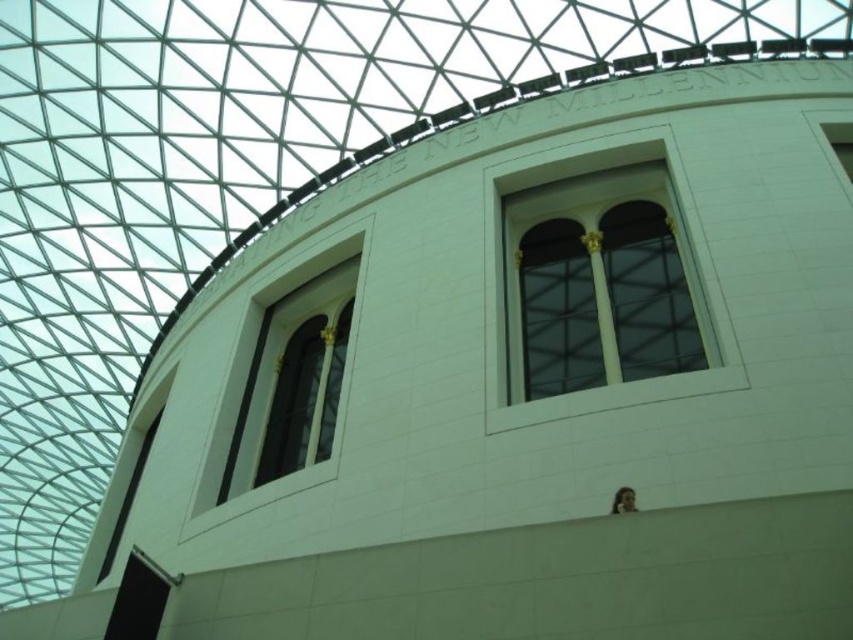
Consider the image. You are an architect designing a new building inspired by the one shown. You need to ensure that the matte glass window at upper left and the matte glass window at upper center align properly with the building design. Which window should be placed lower to maintain the intended aesthetic?

The matte glass window at upper left should be placed lower since it has a lesser height compared to the matte glass window at upper center, ensuring proper alignment with the building design.